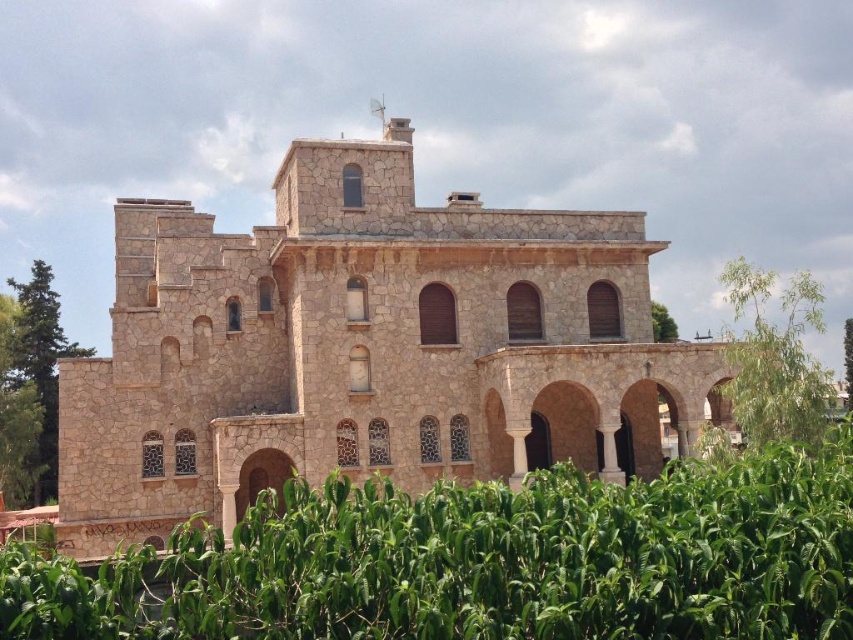
You are standing in front of the building and notice two points marked on the facade. The first point is at coordinates point (354, 204) and the second is at point (746, 400). Which point is closer to you?

Point (354, 204) is closer to you because it is further to the camera than point (746, 400).